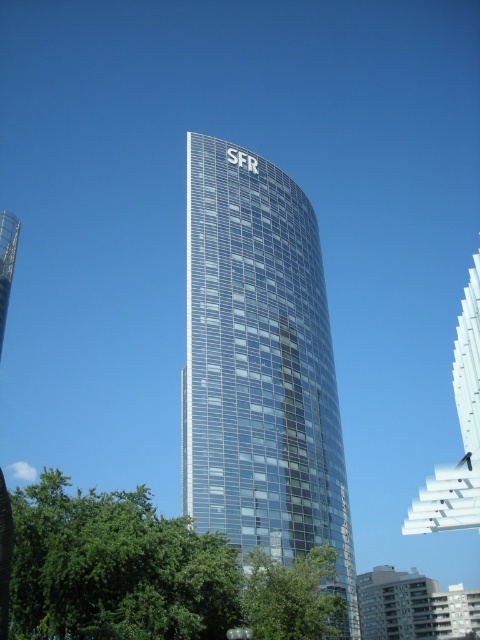
Question: Based on their relative distances, which object is nearer to the transparent glass tower at center?

Choices:
 (A) green leafy tree at lower center
 (B) green leafy tree at lower left

Answer: (A)

Question: Can you confirm if green leafy tree at lower left is smaller than green leafy tree at lower center?

Choices:
 (A) no
 (B) yes

Answer: (A)

Question: Is transparent glass tower at center positioned in front of green leafy tree at lower center?

Choices:
 (A) yes
 (B) no

Answer: (B)

Question: Which is nearer to the green leafy tree at lower center?

Choices:
 (A) transparent glass tower at center
 (B) green leafy tree at lower left

Answer: (B)

Question: Does transparent glass tower at center have a larger size compared to green leafy tree at lower center?

Choices:
 (A) no
 (B) yes

Answer: (B)

Question: Considering the real-world distances, which object is farthest from the transparent glass tower at center?

Choices:
 (A) green leafy tree at lower left
 (B) green leafy tree at lower center

Answer: (A)